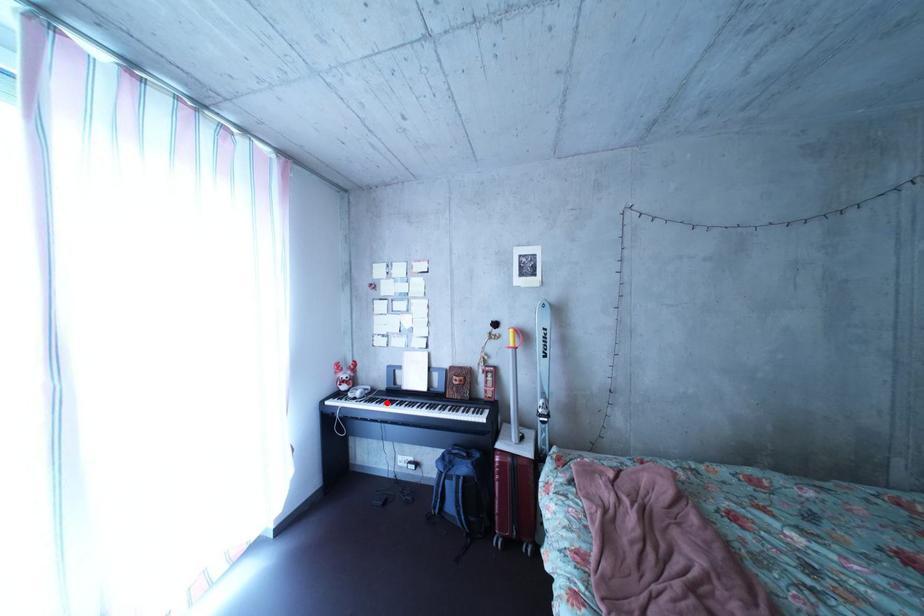
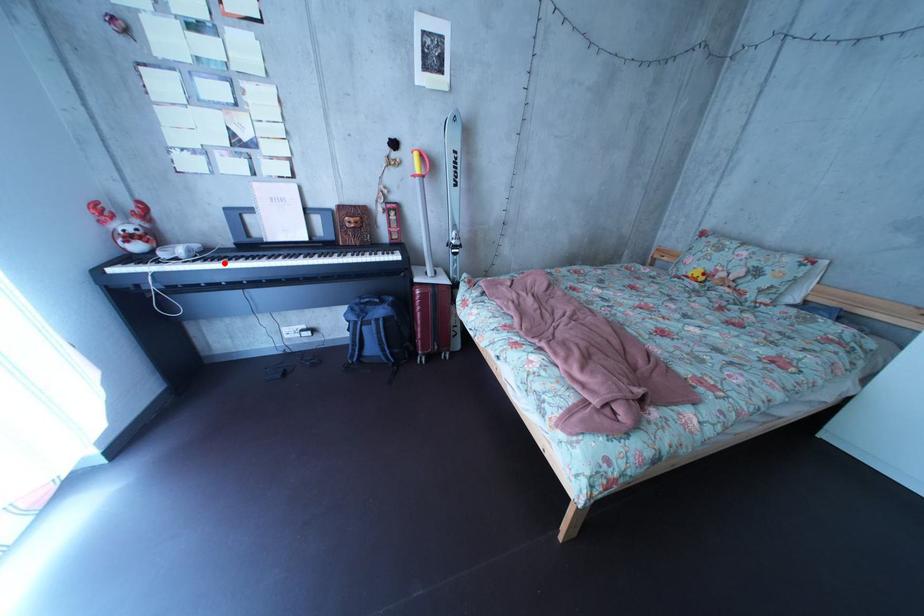
I am providing you with two images of the same scene from different viewpoints. A red point is marked on the first image and another point is marked on the second image. Is the red point in image1 aligned with the point shown in image2?

Yes